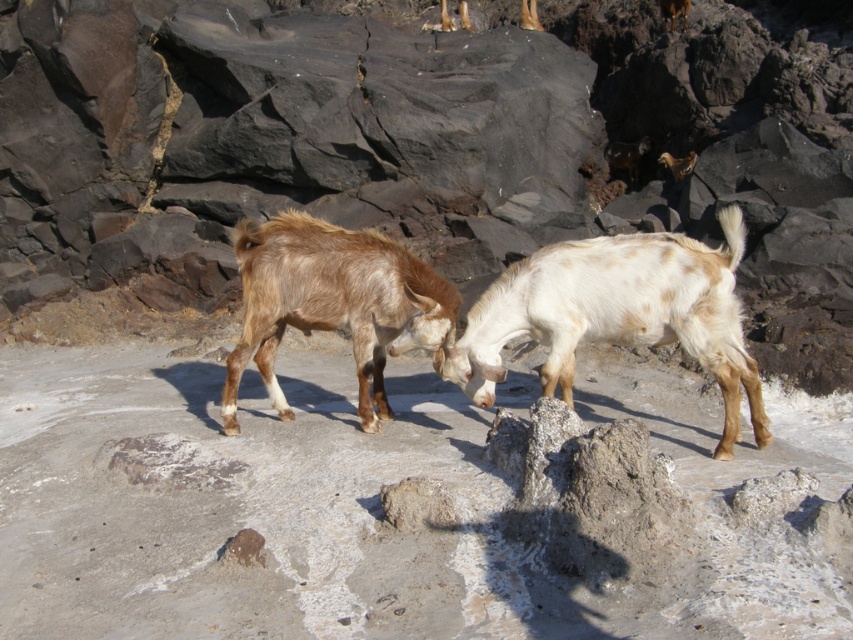
You are a wildlife photographer aiming to capture a closeup shot of both the white speckled fur at center and the brown fuzzy goat at center. Since you want to ensure both are in focus, you need to know which one is bigger. Which goat is larger?

The white speckled fur at center is larger in size than the brown fuzzy goat at center, so you should focus on the white speckled fur at center as it is bigger.

You are a wildlife photographer aiming to capture a closeup shot of both the white speckled fur at center and the brown fuzzy goat at center. Your camera has a maximum focus range of 30 inches. Can you photograph both subjects without moving your camera?

The white speckled fur at center is 30.39 inches away from the brown fuzzy goat at center. Since the distance between them exceeds the camera maximum focus range of 30 inches, you cannot photograph both subjects without moving your camera.

You are a wildlife photographer aiming to capture a closeup of the white speckled fur at center. Based on the scene description, what is the exact coordinate where you should focus your camera?

The white speckled fur at center is located at point (619,314), so you should focus your camera there.